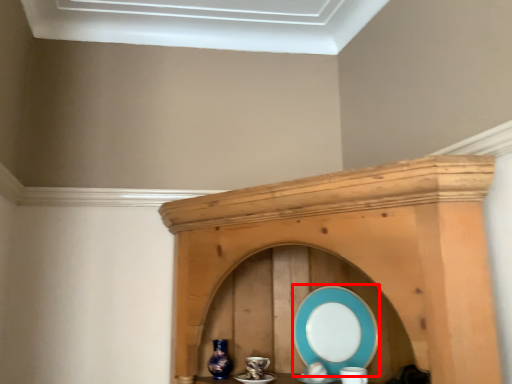
Question: From the image's perspective, what is the correct spatial relationship of platter (annotated by the red box) in relation to vase?

Choices:
 (A) above
 (B) below

Answer: (A)